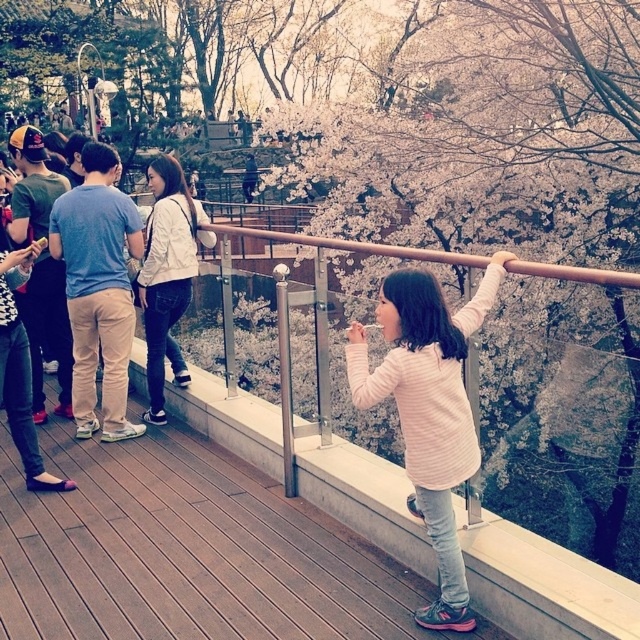
Who is shorter, wooden at center or white matte jacket at upper center?

With less height is wooden at center.

Does wooden at center appear under white matte jacket at upper center?

Yes, wooden at center is below white matte jacket at upper center.

At what (x,y) coordinates should I click in order to perform the action: click on wooden at center. Please return your answer as a coordinate pair (x, y). Image resolution: width=640 pixels, height=640 pixels. Looking at the image, I should click on (544, 586).

Can you confirm if pink striped shirt at center is smaller than white matte jacket at upper center?

Actually, pink striped shirt at center might be larger than white matte jacket at upper center.

At what (x,y) coordinates should I click in order to perform the action: click on pink striped shirt at center. Please return your answer as a coordinate pair (x, y). The width and height of the screenshot is (640, 640). Looking at the image, I should click on (428, 410).

Does point (81, 445) lie in front of point (416, 280)?

No.

Is wooden at center below pink striped shirt at center?

Correct, wooden at center is located below pink striped shirt at center.

Locate an element on the screen. Image resolution: width=640 pixels, height=640 pixels. wooden at center is located at coordinates (544, 586).